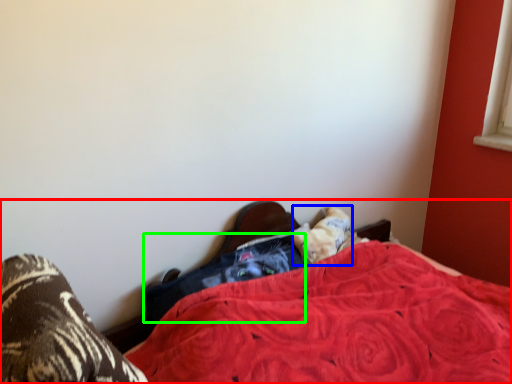
Question: Based on their relative distances, which object is farther from bed (highlighted by a red box)? Choose from pillow (highlighted by a blue box) and clothing (highlighted by a green box).

Choices:
 (A) pillow
 (B) clothing

Answer: (A)